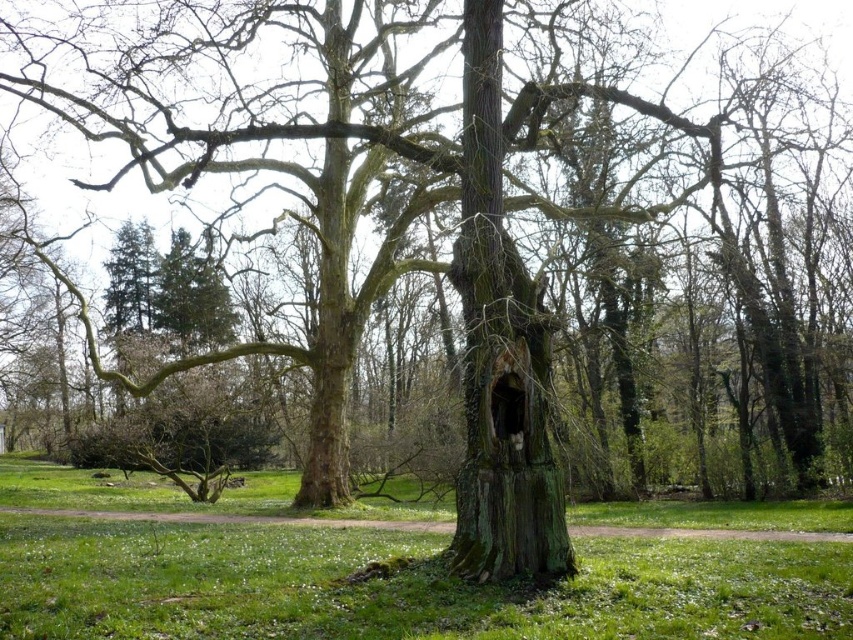
You are a gardener trying to plant a new flowerbed between the green grass at center and the green mossy tree trunk at center. Which area should you choose to ensure the flowers have enough space to spread their roots?

The green grass at center has a larger width than the green mossy tree trunk at center, so planting the flowerbed there would provide more space for the flowers to spread their roots.